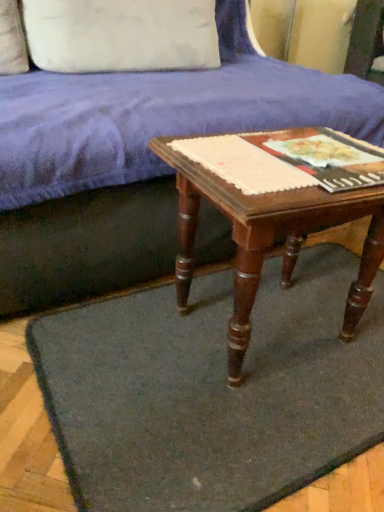
Question: Does white cotton pillow at upper left have a greater width compared to velvet blue couch at upper center?

Choices:
 (A) no
 (B) yes

Answer: (A)

Question: Is white cotton pillow at upper left completely or partially outside of velvet blue couch at upper center?

Choices:
 (A) yes
 (B) no

Answer: (B)

Question: From a real-world perspective, is white cotton pillow at upper left located beneath velvet blue couch at upper center?

Choices:
 (A) no
 (B) yes

Answer: (A)

Question: Is white cotton pillow at upper left closer to camera compared to velvet blue couch at upper center?

Choices:
 (A) no
 (B) yes

Answer: (A)

Question: Does white cotton pillow at upper left have a smaller size compared to velvet blue couch at upper center?

Choices:
 (A) yes
 (B) no

Answer: (A)

Question: Relative to white cotton pillow at upper left, is dark gray felt mat at center in front or behind?

Choices:
 (A) front
 (B) behind

Answer: (A)

Question: Considering the relative positions of dark gray felt mat at center and white cotton pillow at upper left in the image provided, is dark gray felt mat at center to the left or to the right of white cotton pillow at upper left?

Choices:
 (A) left
 (B) right

Answer: (B)

Question: Is point (200, 476) positioned closer to the camera than point (119, 5)?

Choices:
 (A) closer
 (B) farther

Answer: (A)

Question: Is dark gray felt mat at center inside the boundaries of white cotton pillow at upper left, or outside?

Choices:
 (A) outside
 (B) inside

Answer: (A)

Question: Considering the relative positions of wooden table at center and matte paper at center, the 2th paperback book positioned from the left, in the image provided, is wooden table at center to the left or to the right of matte paper at center, the 2th paperback book positioned from the left,?

Choices:
 (A) right
 (B) left

Answer: (B)

Question: From a real-world perspective, relative to matte paper at center, the 2th paperback book positioned from the left, is wooden table at center vertically above or below?

Choices:
 (A) above
 (B) below

Answer: (B)

Question: Considering their positions, is wooden table at center located in front of or behind matte paper at center, the first paperback book when ordered from right to left?

Choices:
 (A) front
 (B) behind

Answer: (A)

Question: Considering the positions of wooden table at center and matte paper at center, the first paperback book when ordered from right to left, in the image, is wooden table at center taller or shorter than matte paper at center, the first paperback book when ordered from right to left,?

Choices:
 (A) short
 (B) tall

Answer: (B)

Question: From a real-world perspective, is dark gray felt mat at center physically located above or below matte paper at center, the first paperback book when ordered from right to left?

Choices:
 (A) below
 (B) above

Answer: (A)

Question: In the image, is dark gray felt mat at center on the left side or the right side of matte paper at center, the 2th paperback book positioned from the left?

Choices:
 (A) right
 (B) left

Answer: (B)